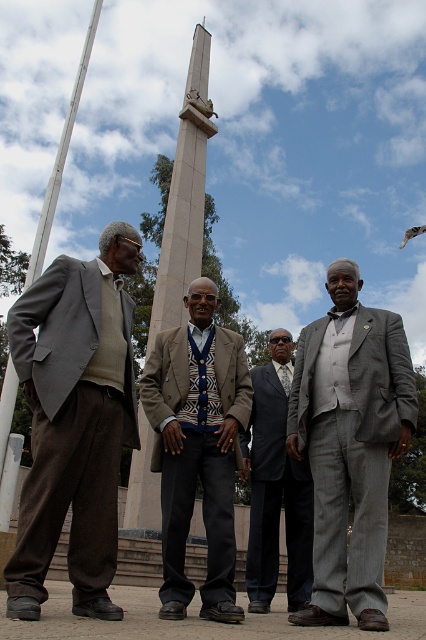
Question: From the image, what is the correct spatial relationship of matte gray suit at left in relation to dark gray suit at center?

Choices:
 (A) left
 (B) right

Answer: (A)

Question: Does matte gray suit at left lie behind gray suit at center?

Choices:
 (A) yes
 (B) no

Answer: (B)

Question: From the image, what is the correct spatial relationship of dark gray suit at center in relation to smooth stone obelisk at center?

Choices:
 (A) right
 (B) left

Answer: (A)

Question: Which object appears farthest from the camera in this image?

Choices:
 (A) smooth stone obelisk at center
 (B) dark gray suit at center
 (C) matte gray suit at left

Answer: (B)

Question: Estimate the real-world distances between objects in this image. Which object is closer to the gray suit at center?

Choices:
 (A) dark gray suit at center
 (B) matte gray suit at left

Answer: (A)

Question: Which of these objects is positioned closest to the gray suit at center?

Choices:
 (A) knitted sweater at center
 (B) dark gray suit at center
 (C) smooth stone obelisk at center

Answer: (A)